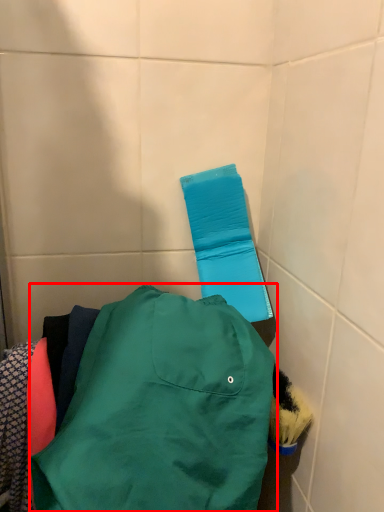
Question: From the image's perspective, considering the relative positions of jacket (annotated by the red box) and towel bar in the image provided, where is jacket (annotated by the red box) located with respect to the staircase?

Choices:
 (A) below
 (B) above

Answer: (A)